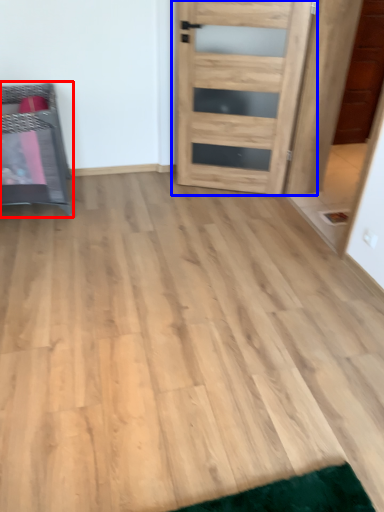
Question: Which object is further to the camera taking this photo, furniture (highlighted by a red box) or door (highlighted by a blue box)?

Choices:
 (A) furniture
 (B) door

Answer: (B)